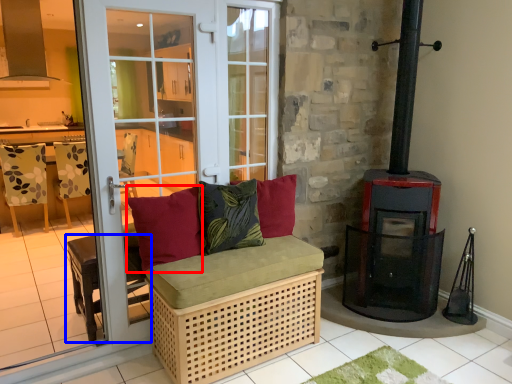
Question: Among these objects, which one is nearest to the camera, pillow (highlighted by a red box) or furniture (highlighted by a blue box)?

Choices:
 (A) pillow
 (B) furniture

Answer: (A)